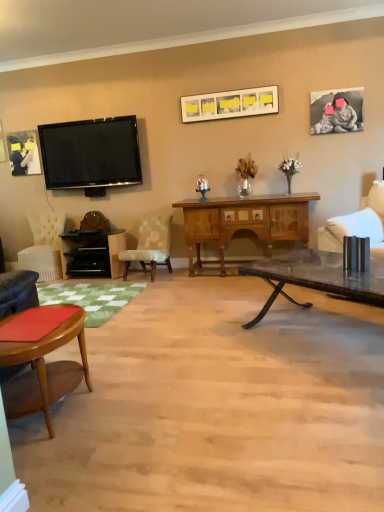
Where is `vacant point to the right of wooden oval chair at lower left, arranged as the third chair when viewed from the right`? vacant point to the right of wooden oval chair at lower left, arranged as the third chair when viewed from the right is located at coordinates [x=139, y=411].